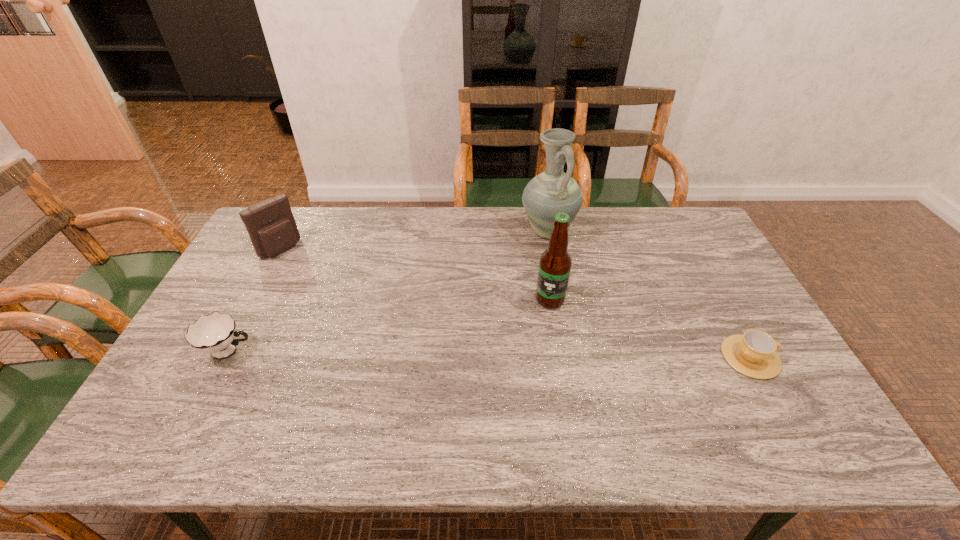
Identify the location of free spot located 0.360m with an open flap on the third tallest object. (356, 309).

The height and width of the screenshot is (540, 960). I want to click on vacant space located with an open flap on the third tallest object, so click(323, 283).

The height and width of the screenshot is (540, 960). Identify the location of vacant point located 0.310m on the label of the third nearest object. (491, 387).

I want to click on vacant space situated on the label of the third nearest object, so click(535, 322).

Find the location of a particular element. vacant space positioned 0.290m on the label of the third nearest object is located at coordinates (494, 381).

Locate an element on the screen. vacant area located on the handle side of the tallest object is located at coordinates (551, 269).

In order to click on vacant region located on the handle side of the tallest object in this screenshot , I will do `click(553, 298)`.

You are a GUI agent. You are given a task and a screenshot of the screen. Output one action in this format:
    pyautogui.click(x=<x>, y=<y>)
    Task: Click on the free space located 0.230m on the handle side of the tallest object
    This screenshot has width=960, height=540.
    Given the screenshot: What is the action you would take?
    pyautogui.click(x=553, y=298)

This screenshot has height=540, width=960. What are the coordinates of `pouch that is at the far edge` in the screenshot? It's located at (272, 228).

Where is `pitcher situated at the far edge`? This screenshot has height=540, width=960. pitcher situated at the far edge is located at coordinates (553, 191).